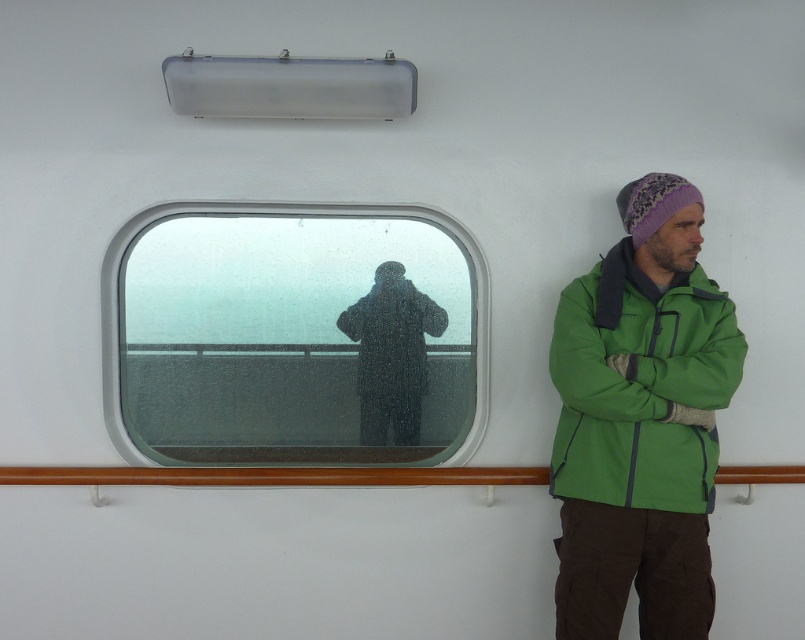
What do you see at coordinates (295, 333) in the screenshot? I see `clear glass window at center` at bounding box center [295, 333].

From the picture: Between clear glass window at center and brown wood rail at center, which one has less height?

brown wood rail at center is shorter.

Which is in front, point (347, 352) or point (237, 481)?

Positioned in front is point (237, 481).

Image resolution: width=805 pixels, height=640 pixels. I want to click on clear glass window at center, so click(295, 333).

Describe the element at coordinates (640, 385) in the screenshot. I see `green softshell jacket at right` at that location.

Is green softshell jacket at right above brown wood rail at center?

Indeed, green softshell jacket at right is positioned over brown wood rail at center.

Locate an element on the screen. green softshell jacket at right is located at coordinates (640, 385).

Who is more forward, [298,300] or [611,253]?

Positioned in front is point [611,253].

Does clear glass window at center appear on the left side of green softshell jacket at right?

Indeed, clear glass window at center is positioned on the left side of green softshell jacket at right.

Who is more forward, (226, 326) or (614, 502)?

Point (614, 502) is more forward.

Where is `clear glass window at center`? clear glass window at center is located at coordinates (295, 333).